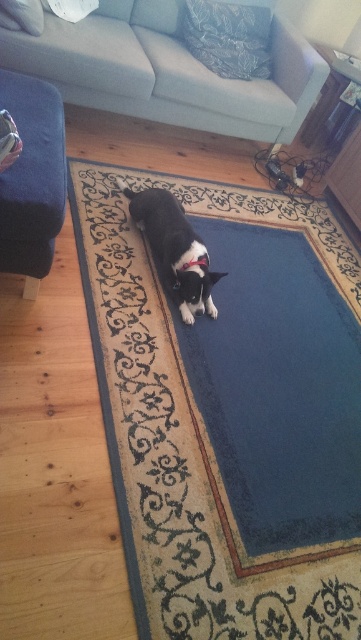
You are arranging a path for a delivery robot to move from the entrance to the kitchen. The robot needs to avoid obstacles. Given the scene, which object should the robot avoid first when moving from the entrance, the light gray fabric couch at upper center or the velvet dark blue ottoman at left?

The velvet dark blue ottoman at left should be avoided first because the light gray fabric couch at upper center is to the right of the velvet dark blue ottoman at left, meaning the ottoman is positioned to the left and closer to the entrance path.

You are a photographer setting up a camera to take a portrait of the black fur dog at center and the pink fabric neckband at center. The camera has a 1.2 meter wide aperture. Will the entire scene of both objects fit through the aperture?

The black fur dog at center might be wider than the pink fabric neckband at center, so the total width of both objects combined may exceed the 1.2 meter aperture. It depends on their exact widths, but there is a possibility the aperture is too narrow.

You are standing at the entrance of the living room and see the point marked at position (167, 72). What object is located at that point?

The light gray fabric couch at upper center is located at point (167, 72).